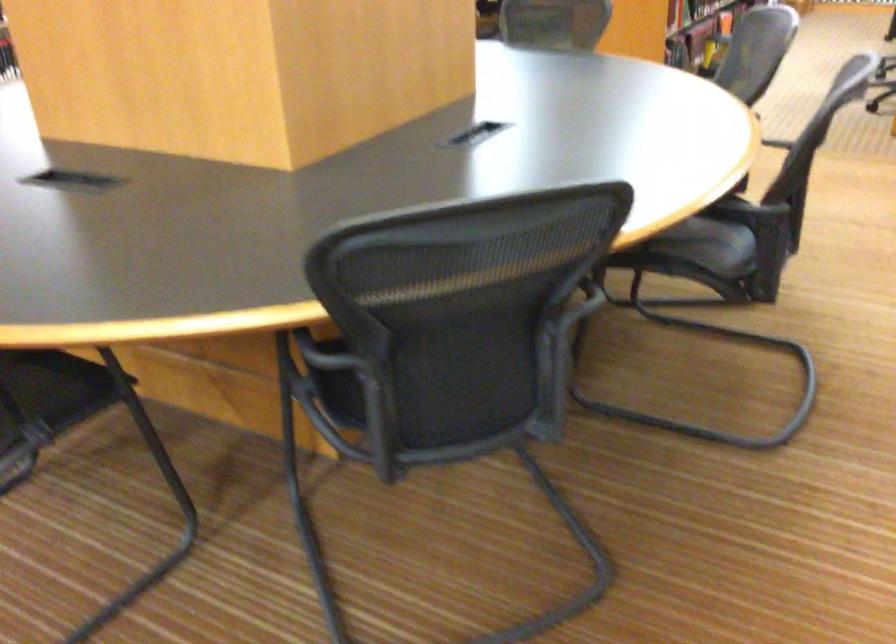
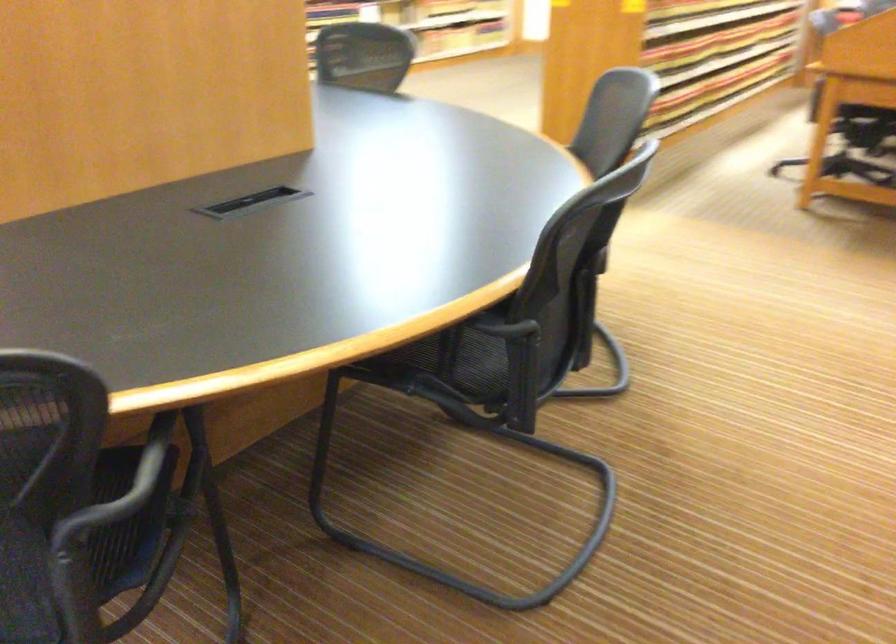
The point at (565, 295) is marked in the first image. Where is the corresponding point in the second image?

(151, 460)